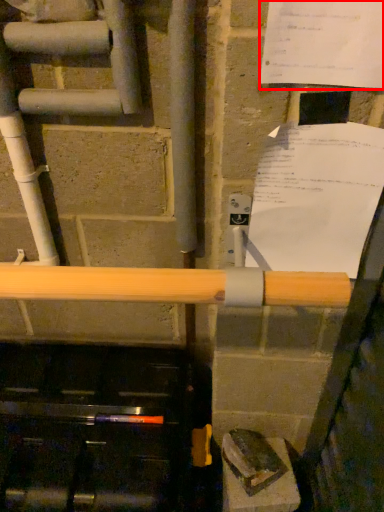
Question: From the image's perspective, considering the relative positions of paper (annotated by the red box) and paper in the image provided, where is paper (annotated by the red box) located with respect to the staircase?

Choices:
 (A) below
 (B) above

Answer: (B)